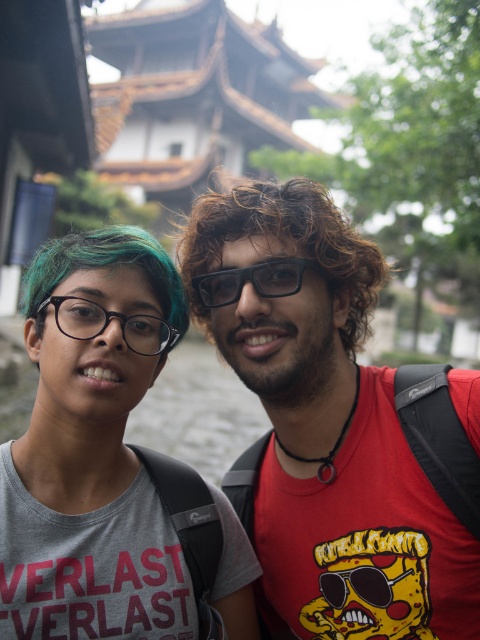
Question: Which of these objects is positioned farthest from the red matte t-shirt at center?

Choices:
 (A) black matte glasses at center
 (B) matte black glasses at left

Answer: (B)

Question: Which object is the closest to the curly brown hair at center?

Choices:
 (A) black matte glasses at center
 (B) matte black glasses at left
 (C) matte gray t-shirt at center
 (D) teal glossy hair at center

Answer: (A)

Question: Can you confirm if curly brown hair at center is positioned to the right of black matte glasses at center?

Choices:
 (A) yes
 (B) no

Answer: (A)

Question: Is black matte glasses at center to the left of black matte sunglasses at center from the viewer's perspective?

Choices:
 (A) no
 (B) yes

Answer: (B)

Question: Which point is closer to the camera?

Choices:
 (A) teal glossy hair at center
 (B) matte black glasses at left

Answer: (B)

Question: Does matte black glasses at left lie behind black matte sunglasses at center?

Choices:
 (A) no
 (B) yes

Answer: (A)